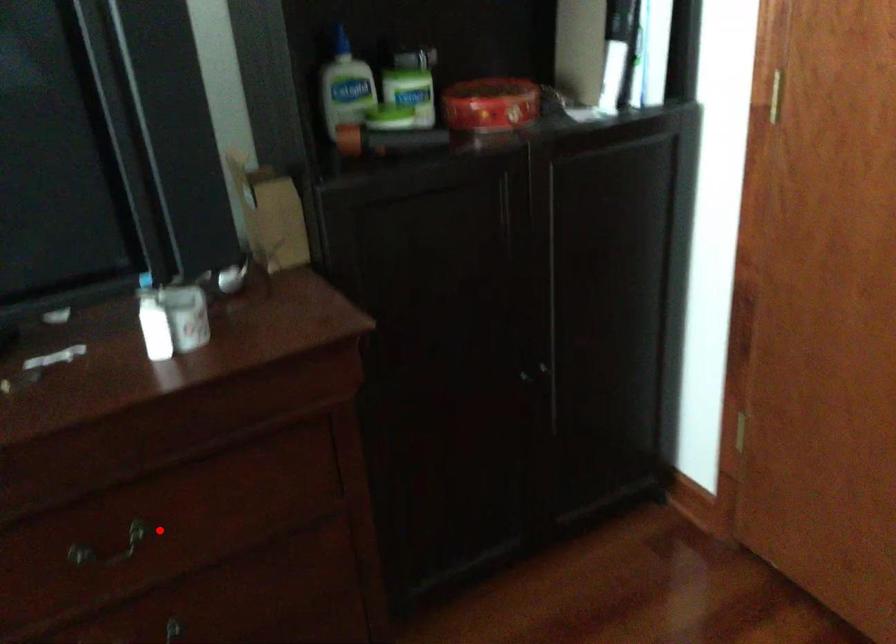
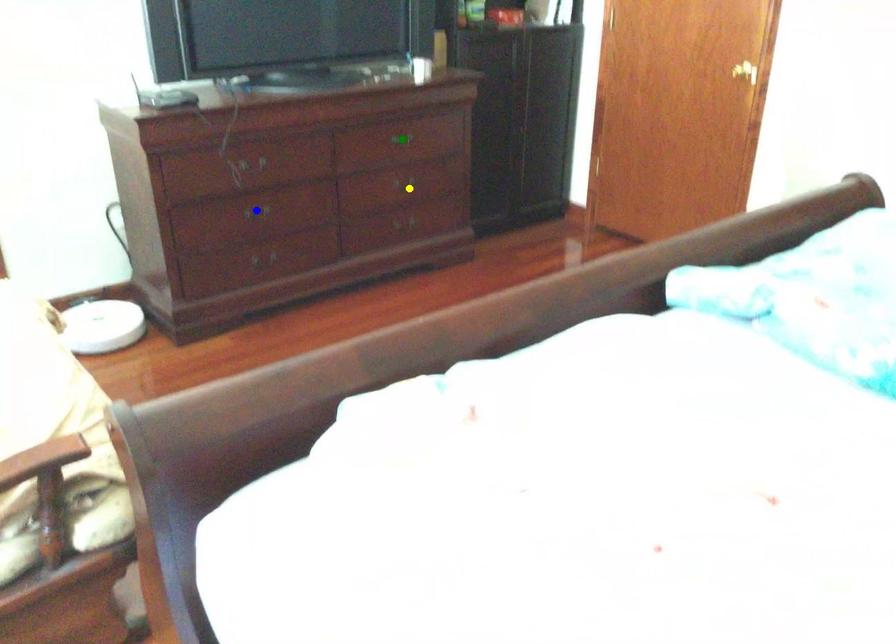
Question: I am providing you with two images of the same scene from different viewpoints. A red point is marked on the first image. You are given multiple points on the second image. Which point in image 2 is actually the same real-world point as the red point in image 1?

Choices:
 (A) green point
 (B) blue point
 (C) yellow point

Answer: (A)